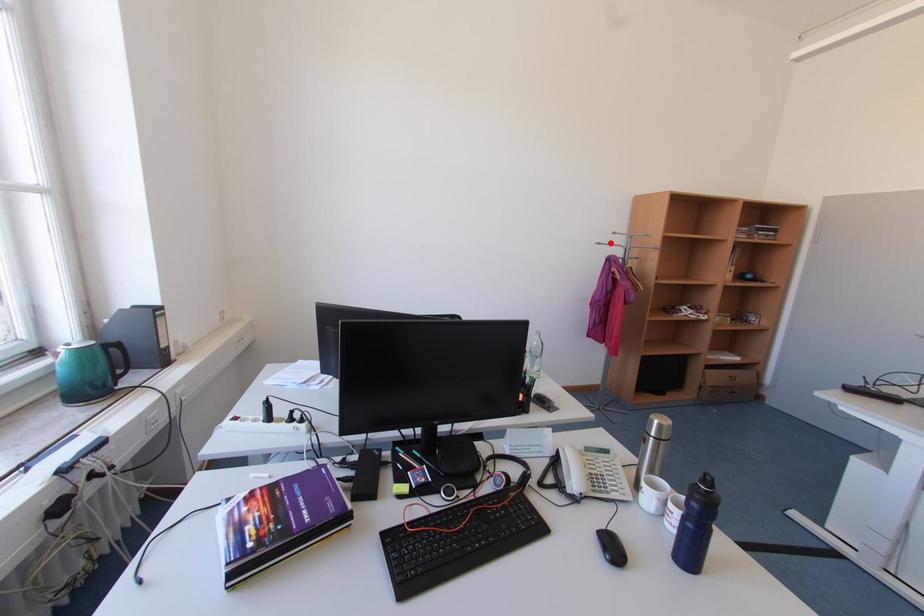
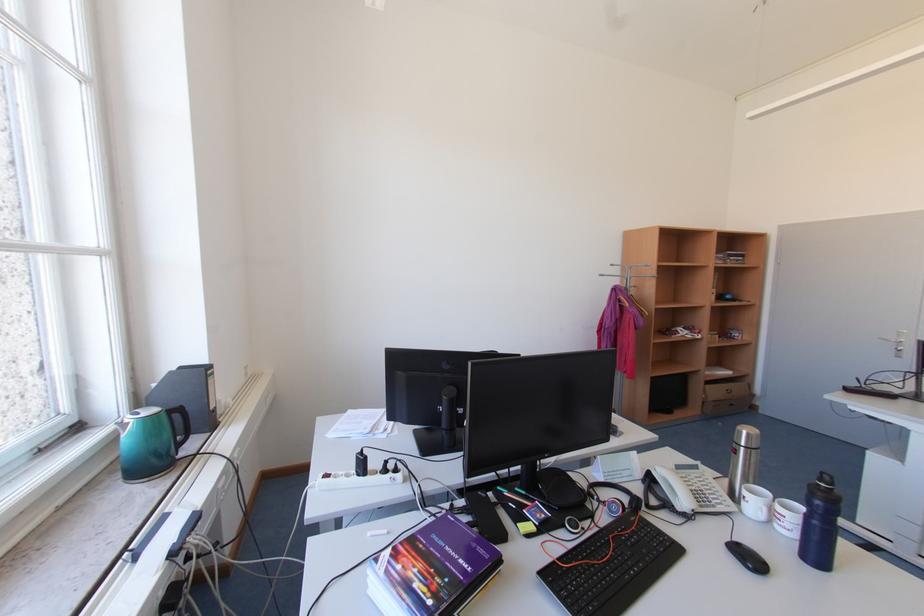
Find the pixel in the second image that matches the highlighted location in the first image.

(613, 275)